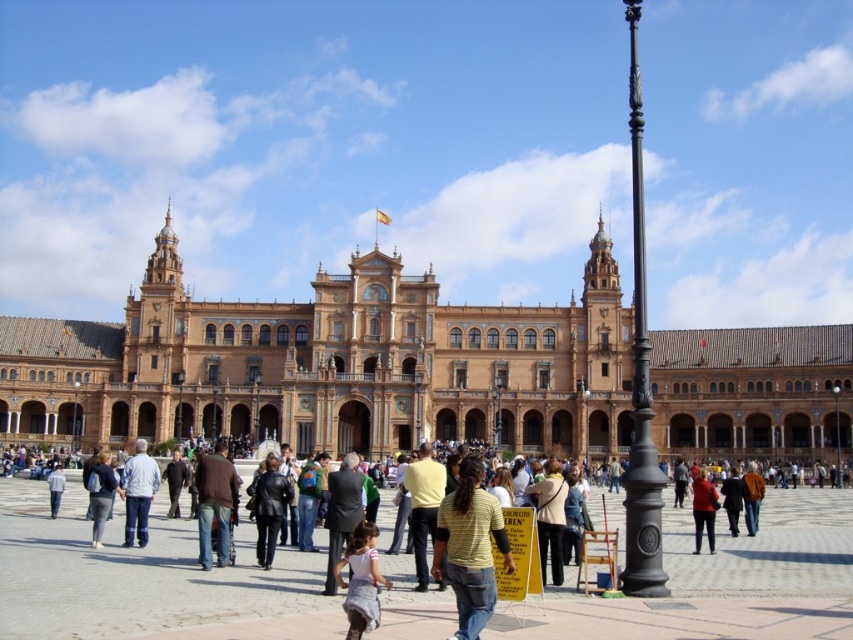
Question: Does black leather jacket at center have a greater width compared to denim pants at lower left?

Choices:
 (A) no
 (B) yes

Answer: (A)

Question: Which point is farther from the camera taking this photo?

Choices:
 (A) (131, 552)
 (B) (363, 579)
 (C) (131, 465)

Answer: (C)

Question: Among these objects, which one is nearest to the camera?

Choices:
 (A) brown leather jacket at center
 (B) yellow matte shirt at center
 (C) matte concrete plaza at center
 (D) black leather jacket at center

Answer: (B)

Question: In this image, where is matte concrete plaza at center located relative to brown leather jacket at center?

Choices:
 (A) right
 (B) left

Answer: (A)

Question: Which object appears closest to the camera in this image?

Choices:
 (A) brown leather jacket at center
 (B) denim pants at lower left
 (C) matte red jacket at center
 (D) matte concrete plaza at center

Answer: (D)

Question: Is matte concrete plaza at center to the right of light brown fabric dress at center from the viewer's perspective?

Choices:
 (A) no
 (B) yes

Answer: (B)